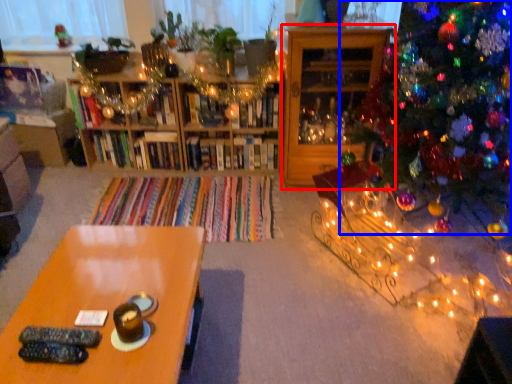
Question: Which point is further to the camera, shelf (highlighted by a red box) or christmas tree (highlighted by a blue box)?

Choices:
 (A) shelf
 (B) christmas tree

Answer: (A)